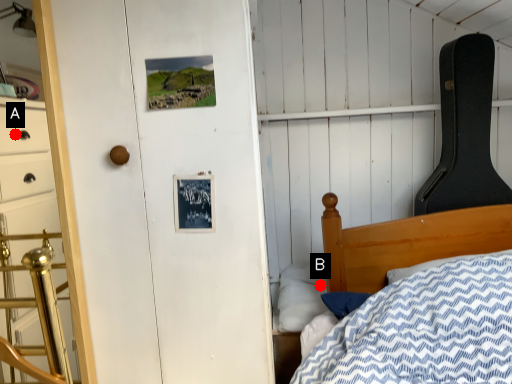
Question: Two points are circled on the image, labeled by A and B beside each circle. Which point appears farthest from the camera in this image?

Choices:
 (A) A is further
 (B) B is further

Answer: (B)